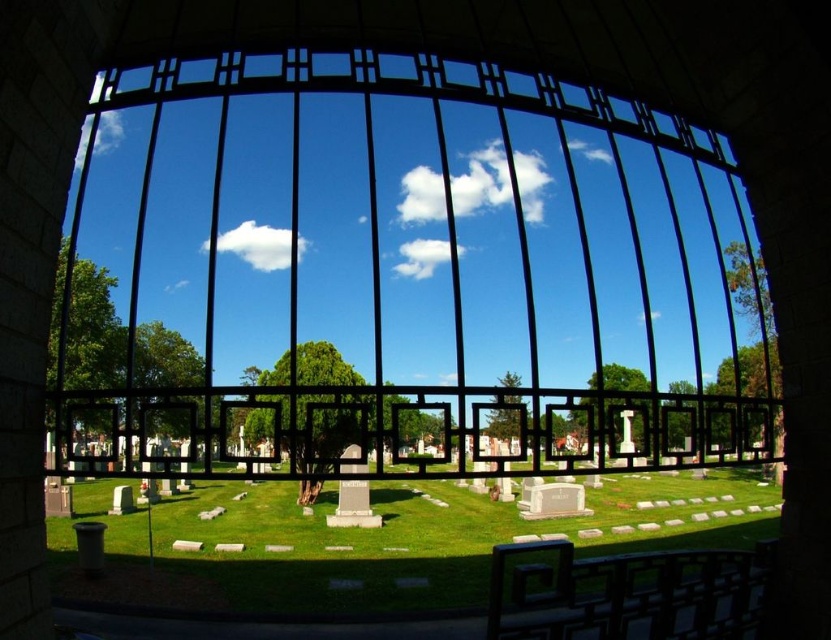
Question: Does black metal gate at center appear on the left side of green grass at center?

Choices:
 (A) yes
 (B) no

Answer: (A)

Question: Observing the image, what is the correct spatial positioning of black metal gate at center in reference to green grass at center?

Choices:
 (A) left
 (B) right

Answer: (A)

Question: Which object is farther from the camera taking this photo?

Choices:
 (A) green grass at center
 (B) black metal gate at center

Answer: (A)

Question: Which of the following is the farthest from the observer?

Choices:
 (A) (416, 536)
 (B) (409, 96)

Answer: (A)

Question: Is black metal gate at center wider than green grass at center?

Choices:
 (A) yes
 (B) no

Answer: (A)